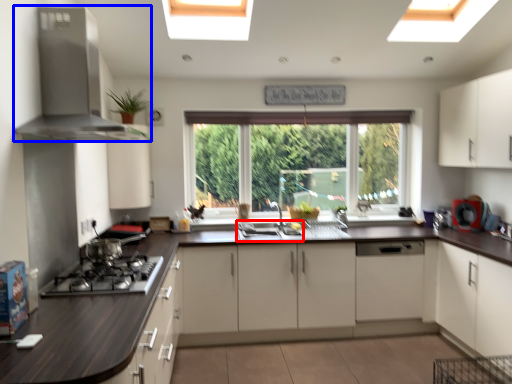
Question: Among these objects, which one is farthest to the camera, sink (highlighted by a red box) or kitchen appliance (highlighted by a blue box)?

Choices:
 (A) sink
 (B) kitchen appliance

Answer: (A)